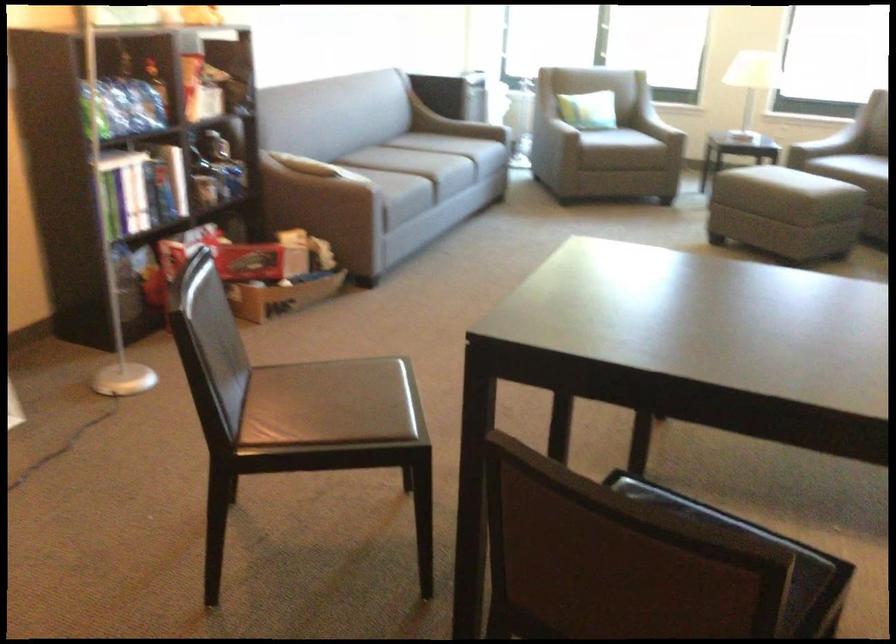
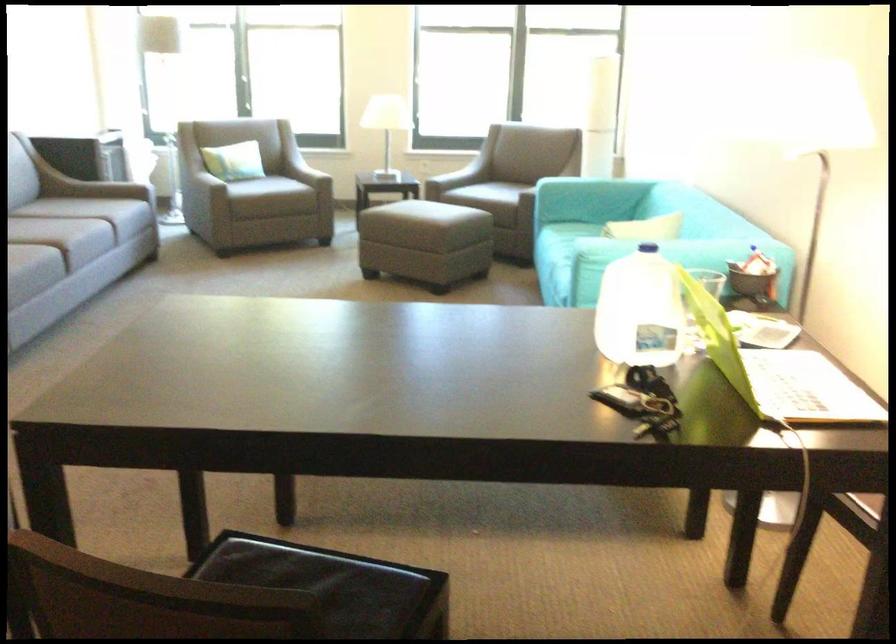
How did the camera likely rotate?

The rotation direction of the camera is right-down.